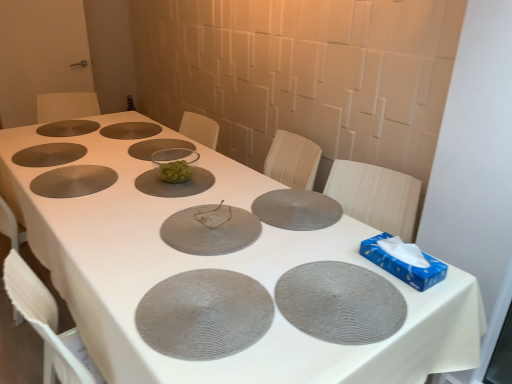
Find the location of a particular element. vacant area that lies between matte gray glass plate at center, which ranks as the eighth glass plate in back-to-front order, and green glass bowl at center is located at coordinates (176, 193).